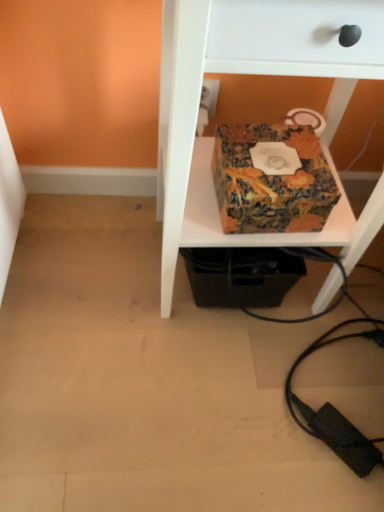
Identify the location of empty space that is ontop of marbled paper box at center (from a real-world perspective). (273, 155).